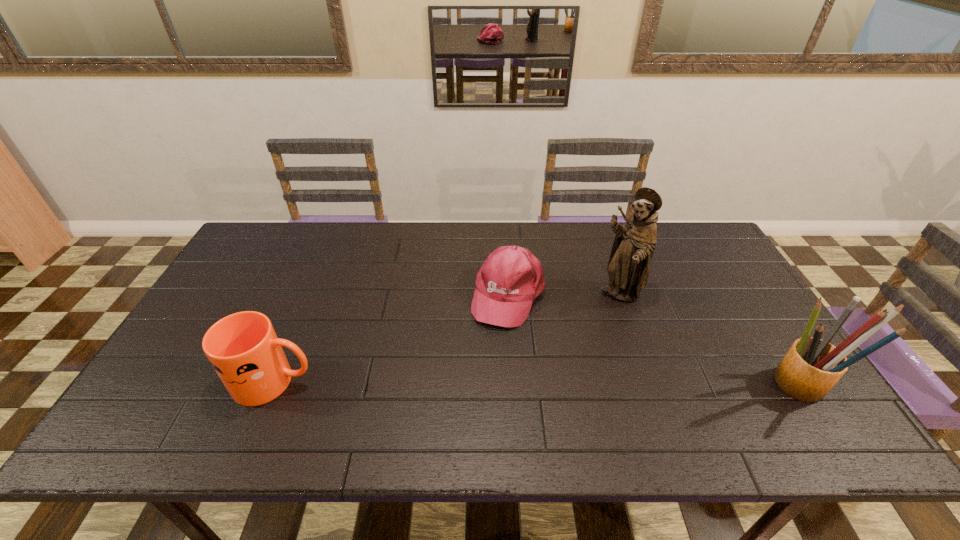
Identify the location of vacant space located on the front-facing side of the figurine. (594, 371).

I want to click on free space located 0.320m on the front-facing side of the figurine, so click(586, 396).

What are the coordinates of `vacant space situated on the front-facing side of the figurine` in the screenshot? It's located at (603, 346).

What are the coordinates of `vacant space located at the front of the shortest object with the brim` in the screenshot? It's located at (491, 348).

Locate an element on the screen. free space located at the front of the shortest object with the brim is located at coordinates (488, 357).

Locate an element on the screen. vacant space positioned 0.230m at the front of the shortest object with the brim is located at coordinates (471, 398).

In order to click on object positioned at the far edge in this screenshot , I will do `click(511, 277)`.

Locate an element on the screen. mug that is positioned at the near edge is located at coordinates (243, 348).

Where is `pencil box located at the near edge`? This screenshot has width=960, height=540. pencil box located at the near edge is located at coordinates (812, 366).

Identify the location of object that is at the right edge. (812, 366).